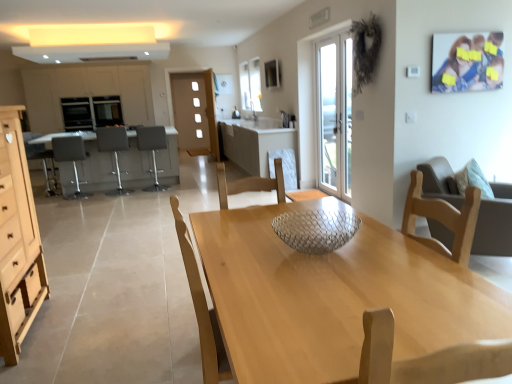
Locate an element on the screen. This screenshot has height=384, width=512. vacant area in front of clear glass bowl at center is located at coordinates (324, 290).